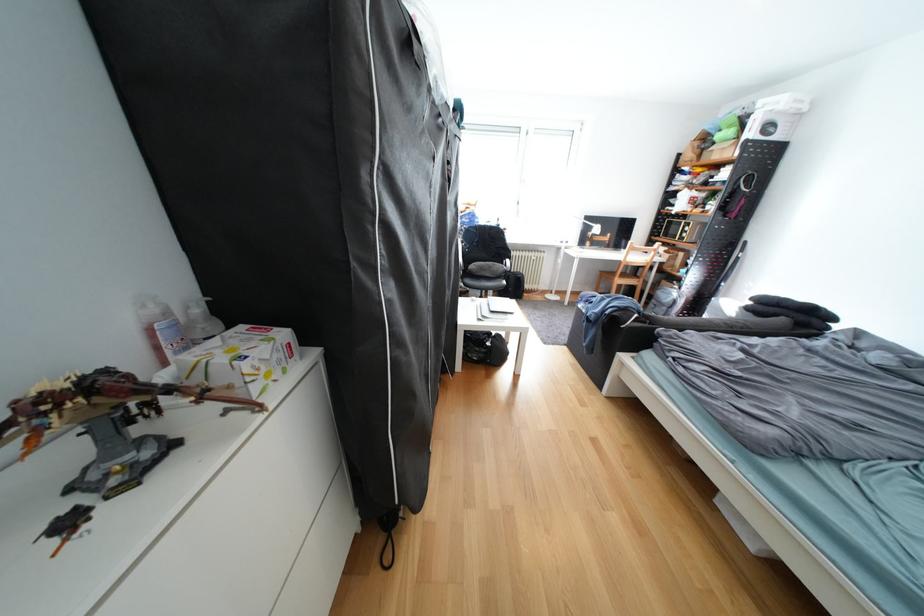
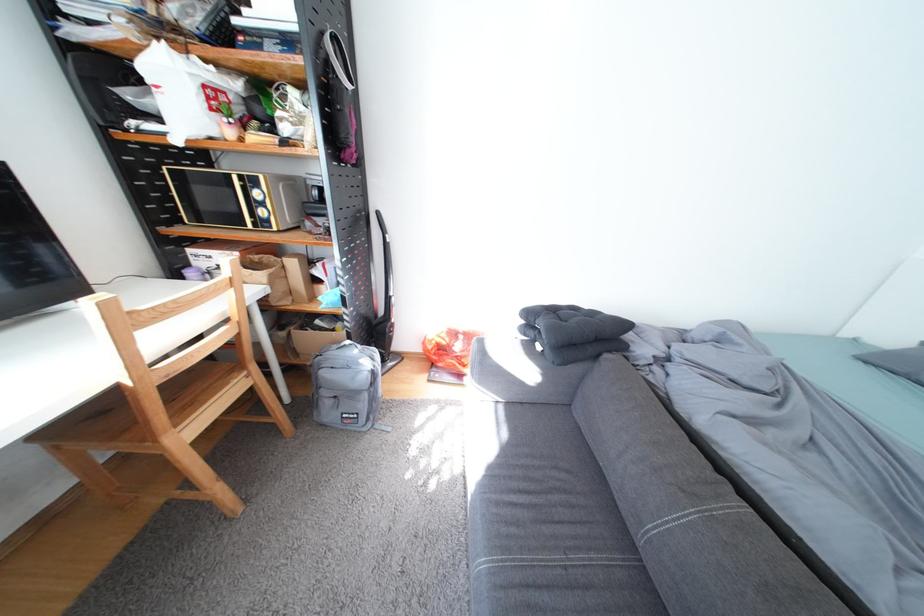
Locate, in the second image, the point that corresponds to point (677, 310) in the first image.

(378, 397)